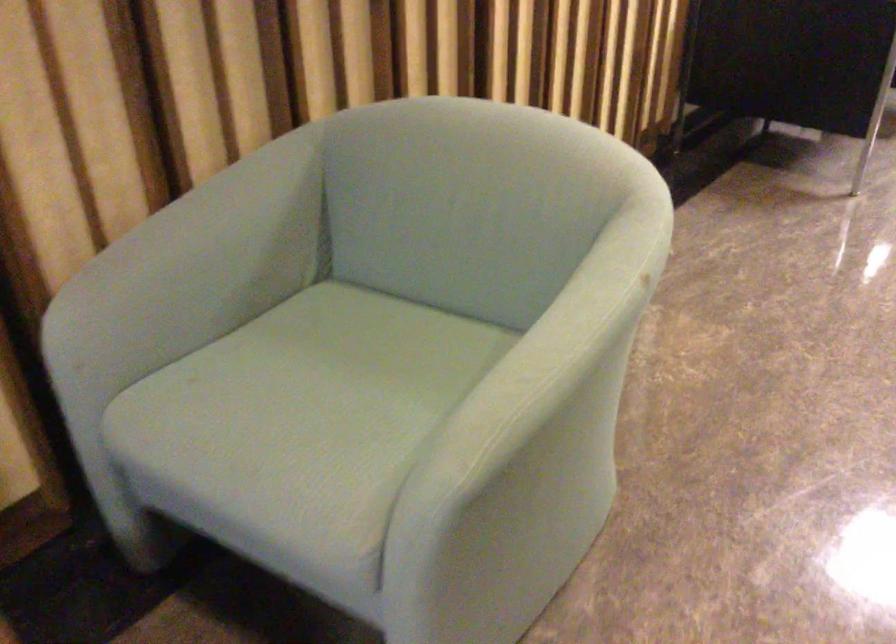
The width and height of the screenshot is (896, 644). Identify the location of chair sitting surface. (305, 398).